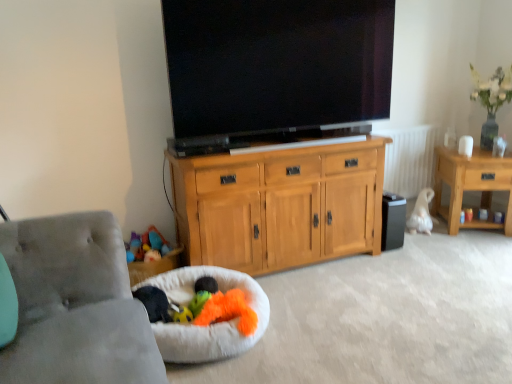
Identify the location of vacant space to the right of white fluffy dog at right. (441, 227).